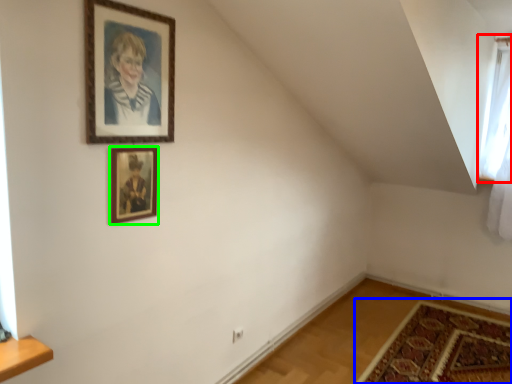
Question: Based on their relative distances, which object is nearer to window (highlighted by a red box)? Choose from mat (highlighted by a blue box) and picture frame (highlighted by a green box).

Choices:
 (A) mat
 (B) picture frame

Answer: (A)